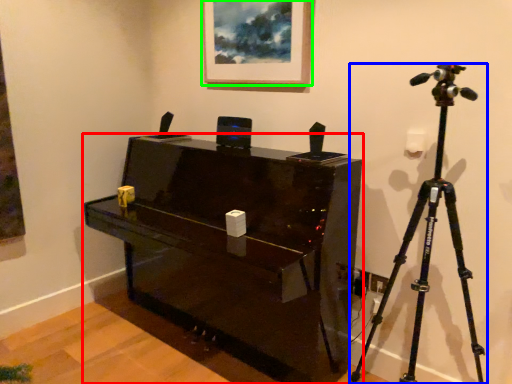
Question: Estimate the real-world distances between objects in this image. Which object is closer to furniture (highlighted by a red box), tripod (highlighted by a blue box) or picture frame (highlighted by a green box)?

Choices:
 (A) tripod
 (B) picture frame

Answer: (A)